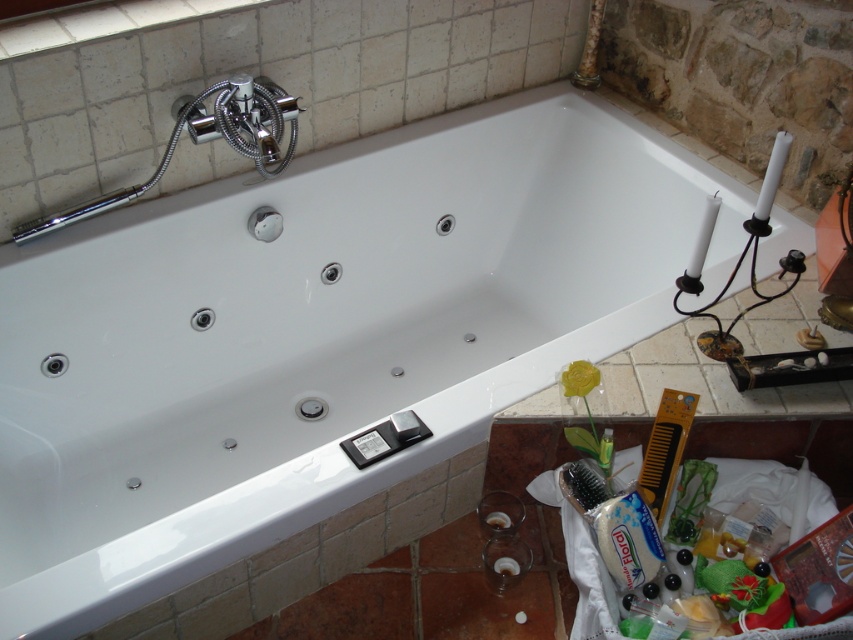
Can you confirm if chrome/metallic showerhead at upper left is thinner than yellow plastic comb at lower right?

Incorrect, chrome/metallic showerhead at upper left's width is not less than yellow plastic comb at lower right's.

Does chrome/metallic showerhead at upper left appear under yellow plastic comb at lower right?

No, chrome/metallic showerhead at upper left is not below yellow plastic comb at lower right.

Which is behind, point (294, 138) or point (671, 435)?

The point (294, 138) is behind.

Locate an element on the screen. The width and height of the screenshot is (853, 640). chrome/metallic showerhead at upper left is located at coordinates (206, 140).